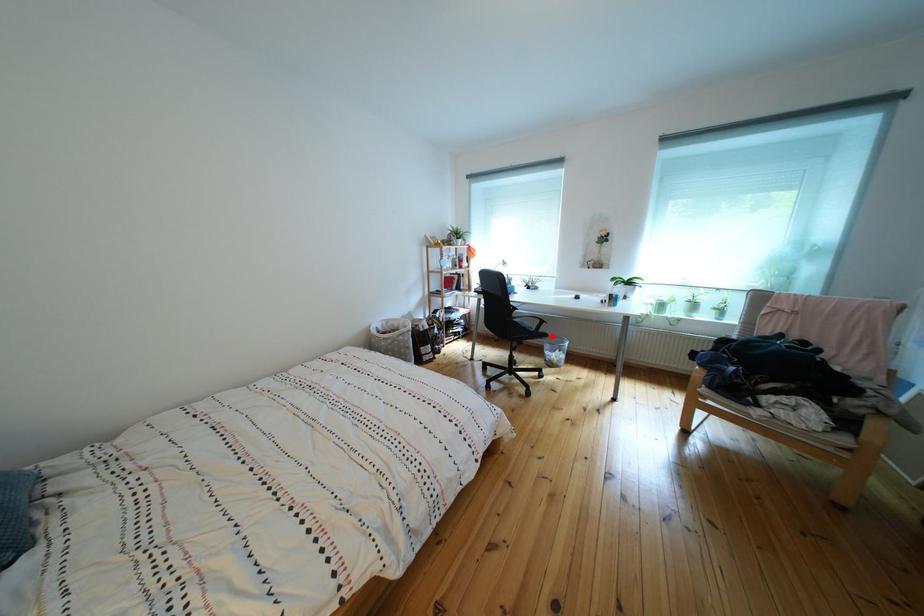
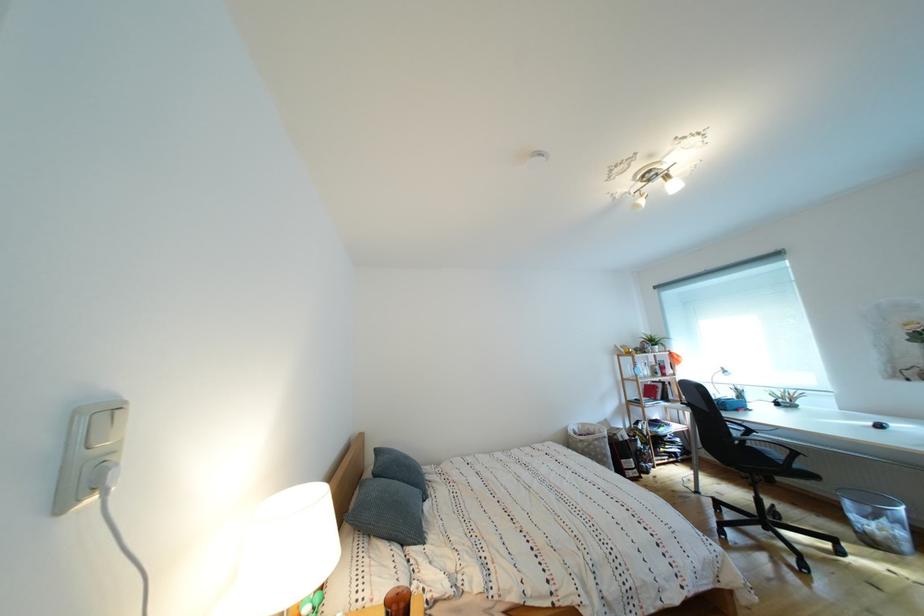
The point at the highlighted location is marked in the first image. Where is the corresponding point in the second image?

(808, 472)